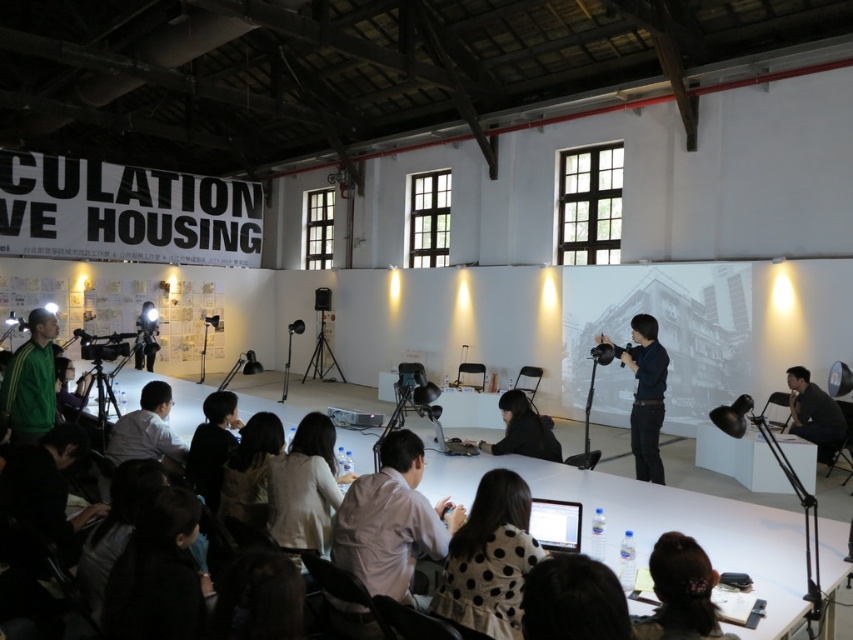
You are a photographer at the event and need to capture a photo of the attendee with brown hair at lower center without the black matte camera at center appearing in the shot. How should you adjust your camera position?

Move the camera to the right so that the brown hair at lower center is no longer to the left of the black matte camera at center, thus avoiding the camera in the photo.

Consider the image. You are standing at the entrance of the room and want to locate the person with brown hair at lower center. According to the coordinates provided, where should you look relative to the room?

The brown hair at lower center is located at coordinates point (680, 593), which means you should look towards the lower right and bottom portion of the room to find the person.